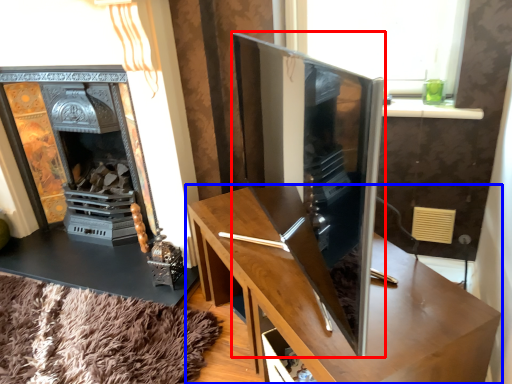
Question: Which point is closer to the camera, tv cabinet (highlighted by a red box) or table (highlighted by a blue box)?

Choices:
 (A) tv cabinet
 (B) table

Answer: (A)